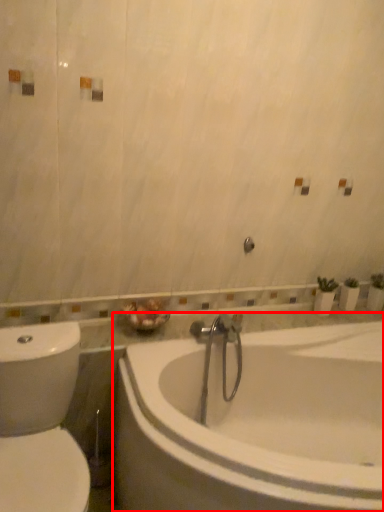
Question: From the image's perspective, what is the correct spatial relationship of bathtub (annotated by the red box) in relation to toilet?

Choices:
 (A) below
 (B) above

Answer: (A)